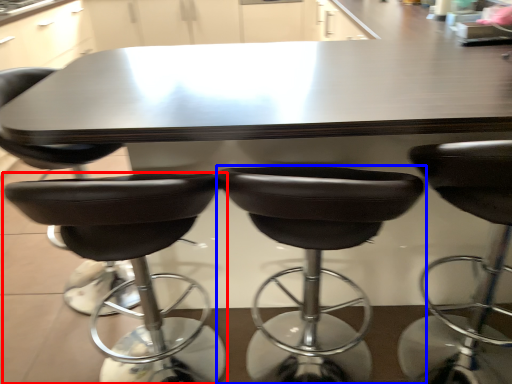
Question: Among these objects, which one is nearest to the camera, chair (highlighted by a red box) or chair (highlighted by a blue box)?

Choices:
 (A) chair
 (B) chair

Answer: (B)